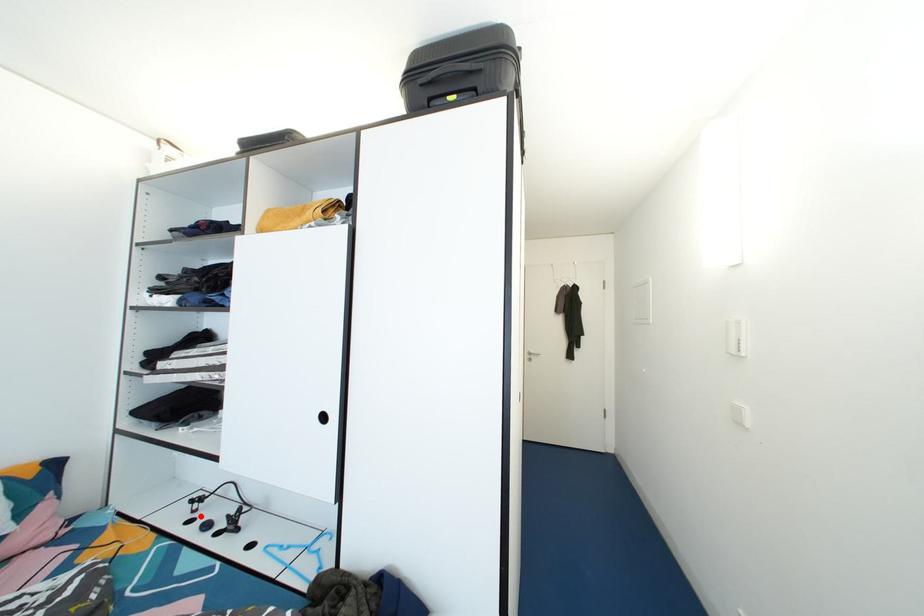
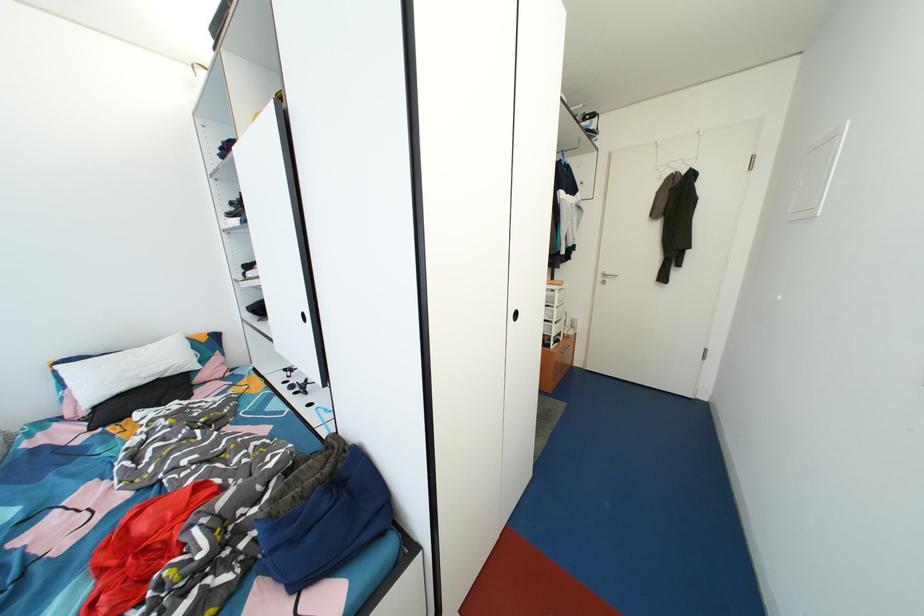
Question: I am providing you with two images of the same scene from different viewpoints. A red point is marked on the first image. Is the red point's position out of view in image 2?

Choices:
 (A) Yes
 (B) No

Answer: (B)